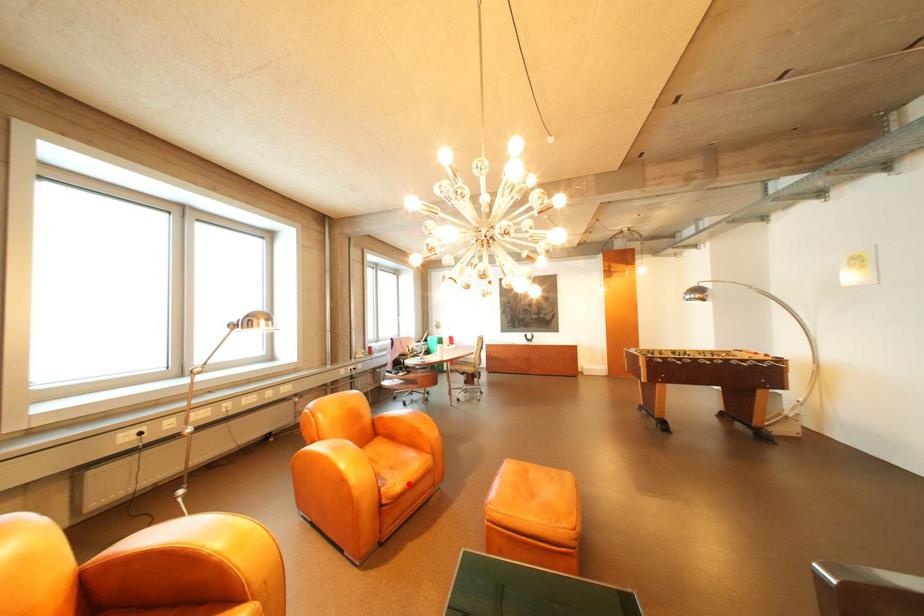
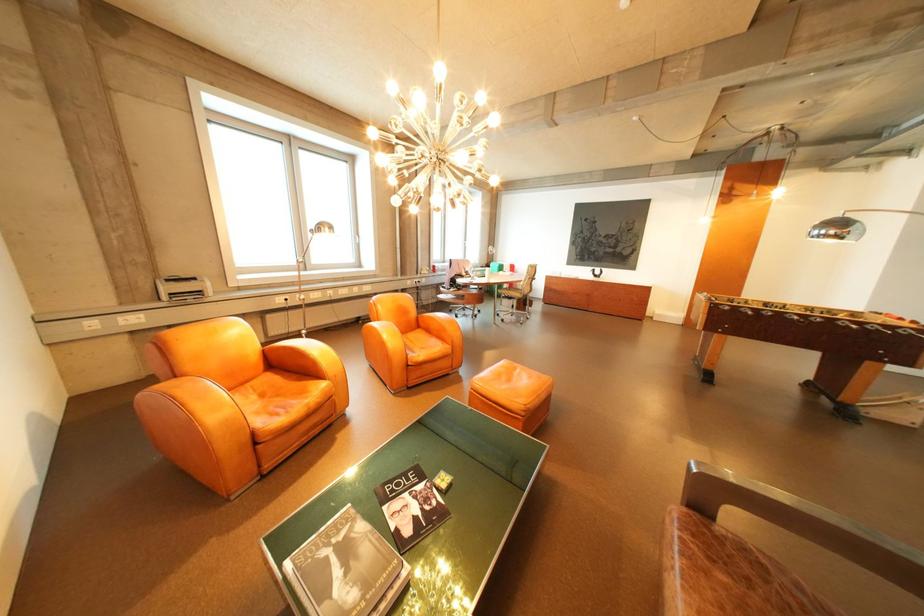
Question: I am providing you with two images of the same scene from different viewpoints. Given a red point in image1, look at the same physical point in image2. Is it:

Choices:
 (A) Closer to the viewpoint
 (B) Farther from the viewpoint

Answer: (B)